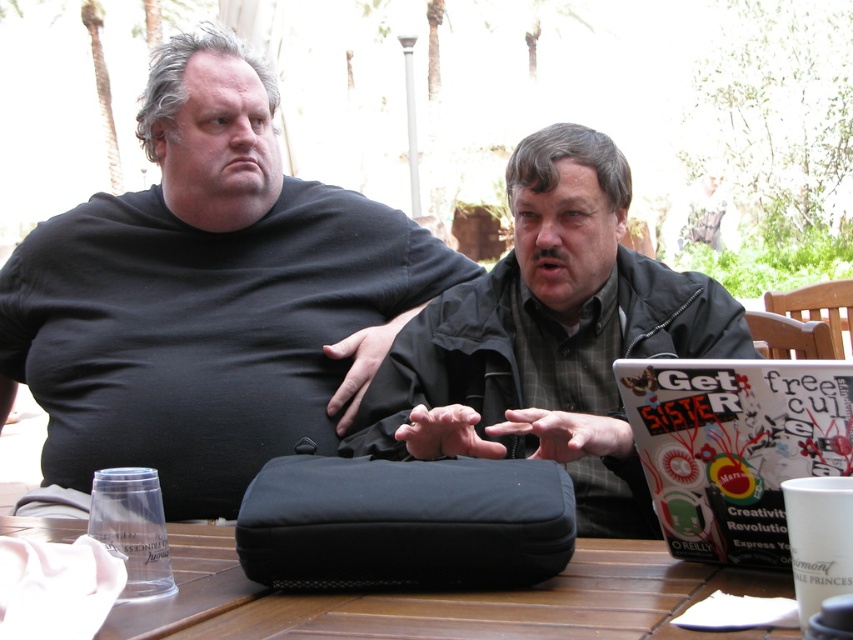
Is green plaid shirt at center positioned behind black fabric bag at center?

Yes, green plaid shirt at center is behind black fabric bag at center.

Does green plaid shirt at center have a lesser height compared to black fabric bag at center?

No, green plaid shirt at center is not shorter than black fabric bag at center.

Which is behind, point (461, 298) or point (440, 573)?

Positioned behind is point (461, 298).

At what (x,y) coordinates should I click in order to perform the action: click on green plaid shirt at center. Please return your answer as a coordinate pair (x, y). The height and width of the screenshot is (640, 853). Looking at the image, I should click on (549, 339).

Is point (170, 236) farther from viewer compared to point (543, 300)?

That is True.

Between black matte bag at center and green plaid shirt at center, which one is positioned higher?

black matte bag at center

Does point (352, 289) come farther from viewer compared to point (689, 332)?

Yes, point (352, 289) is farther from viewer.

At what (x,y) coordinates should I click in order to perform the action: click on black matte bag at center. Please return your answer as a coordinate pair (x, y). This screenshot has width=853, height=640. Looking at the image, I should click on (207, 296).

Who is more forward, (184, 410) or (412, 493)?

Point (412, 493) is more forward.

Measure the distance between black matte bag at center and camera.

black matte bag at center and camera are 1.76 meters apart.

This screenshot has height=640, width=853. I want to click on black matte bag at center, so click(x=207, y=296).

Where is `black matte bag at center`? This screenshot has height=640, width=853. black matte bag at center is located at coordinates click(207, 296).